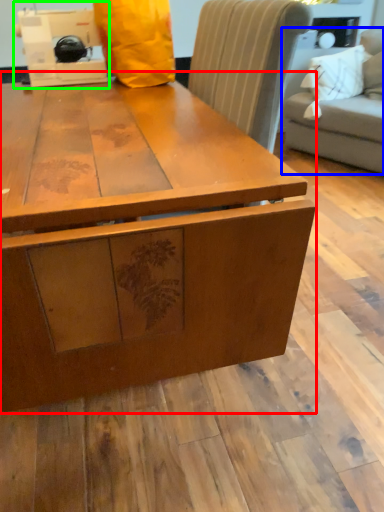
Question: Which object is the closest to the table (highlighted by a red box)? Choose among these: studio couch (highlighted by a blue box) or sewing machine (highlighted by a green box).

Choices:
 (A) studio couch
 (B) sewing machine

Answer: (B)